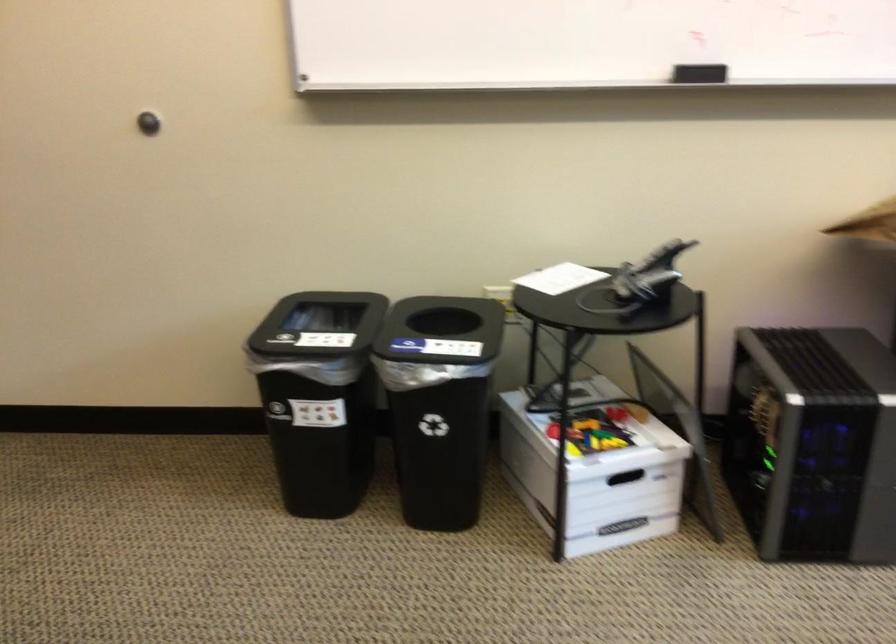
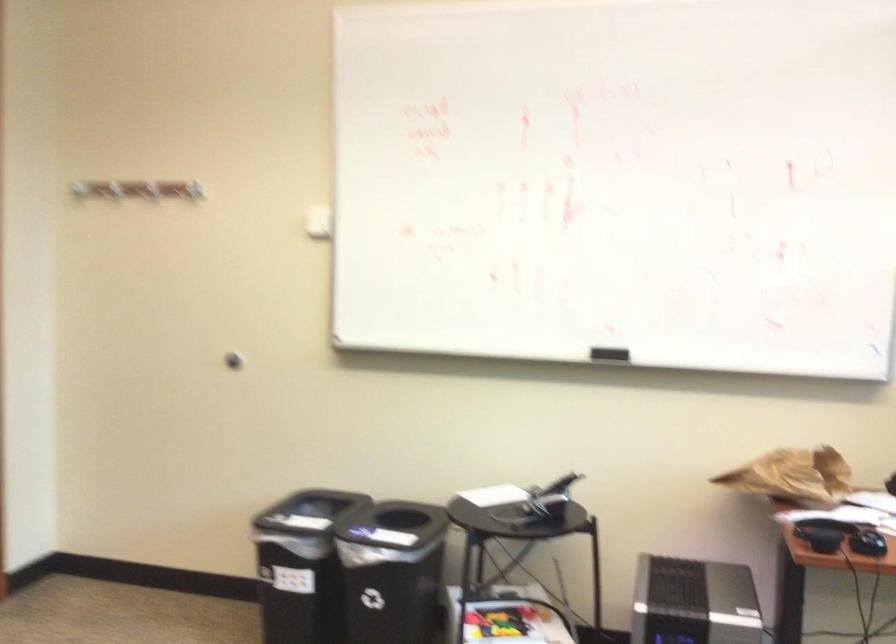
What movement of the cameraman would produce the second image?

The cameraman moved toward right, backward.